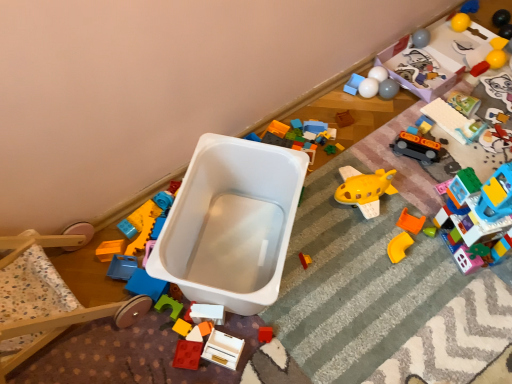
The width and height of the screenshot is (512, 384). I want to click on vacant space that is in between matte yellow toy airplane at center, placed as the 12th toy when sorted from right to left, and orange plastic train at center, the eleventh toy positioned from the left, so click(380, 202).